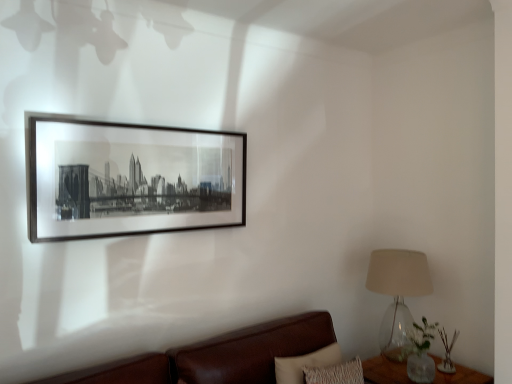
Question: Does black matte picture frame at upper center have a greater height compared to green glass vase at lower right?

Choices:
 (A) yes
 (B) no

Answer: (A)

Question: Is green glass vase at lower right at the back of black matte picture frame at upper center?

Choices:
 (A) yes
 (B) no

Answer: (B)

Question: Considering the relative positions of black matte picture frame at upper center and green glass vase at lower right in the image provided, is black matte picture frame at upper center to the left of green glass vase at lower right from the viewer's perspective?

Choices:
 (A) yes
 (B) no

Answer: (A)

Question: Would you say black matte picture frame at upper center is outside green glass vase at lower right?

Choices:
 (A) yes
 (B) no

Answer: (A)

Question: From a real-world perspective, is black matte picture frame at upper center physically below green glass vase at lower right?

Choices:
 (A) yes
 (B) no

Answer: (B)

Question: Considering the positions of translucent glass lampshade at right and green glass vase at lower right in the image, is translucent glass lampshade at right wider or thinner than green glass vase at lower right?

Choices:
 (A) wide
 (B) thin

Answer: (A)

Question: Considering the positions of translucent glass lampshade at right and green glass vase at lower right in the image, is translucent glass lampshade at right bigger or smaller than green glass vase at lower right?

Choices:
 (A) small
 (B) big

Answer: (B)

Question: Is translucent glass lampshade at right in front of or behind green glass vase at lower right in the image?

Choices:
 (A) front
 (B) behind

Answer: (A)

Question: From a real-world perspective, is translucent glass lampshade at right physically located above or below green glass vase at lower right?

Choices:
 (A) below
 (B) above

Answer: (B)

Question: Considering the relative positions of green glass vase at lower right and clear glass table at lower right in the image provided, is green glass vase at lower right to the left or to the right of clear glass table at lower right?

Choices:
 (A) right
 (B) left

Answer: (A)

Question: Is green glass vase at lower right in front of or behind clear glass table at lower right in the image?

Choices:
 (A) front
 (B) behind

Answer: (B)

Question: In terms of size, does green glass vase at lower right appear bigger or smaller than clear glass table at lower right?

Choices:
 (A) big
 (B) small

Answer: (B)

Question: Is green glass vase at lower right taller or shorter than clear glass table at lower right?

Choices:
 (A) short
 (B) tall

Answer: (A)

Question: Would you say green glass vase at lower right is to the left or to the right of translucent glass lampshade at right in the picture?

Choices:
 (A) left
 (B) right

Answer: (B)

Question: Do you think green glass vase at lower right is within translucent glass lampshade at right, or outside of it?

Choices:
 (A) outside
 (B) inside

Answer: (A)